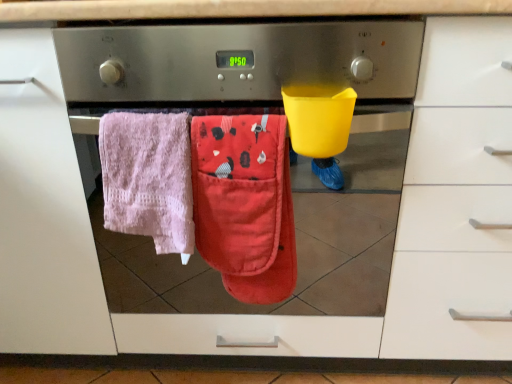
Question: Can you confirm if pink terry cloth towel at left, arranged as the second beach towel when viewed from the right, is positioned to the left of red cotton oven mitt at center, arranged as the first beach towel when viewed from the right?

Choices:
 (A) no
 (B) yes

Answer: (B)

Question: From the image's perspective, does pink terry cloth towel at left, marked as the 1th beach towel in a left-to-right arrangement, appear lower than red cotton oven mitt at center, placed as the 2th beach towel when sorted from left to right?

Choices:
 (A) yes
 (B) no

Answer: (B)

Question: Is pink terry cloth towel at left, marked as the 1th beach towel in a left-to-right arrangement, smaller than red cotton oven mitt at center, arranged as the first beach towel when viewed from the right?

Choices:
 (A) no
 (B) yes

Answer: (A)

Question: Does pink terry cloth towel at left, arranged as the second beach towel when viewed from the right, touch red cotton oven mitt at center, arranged as the first beach towel when viewed from the right?

Choices:
 (A) yes
 (B) no

Answer: (A)

Question: From the image's perspective, does pink terry cloth towel at left, marked as the 1th beach towel in a left-to-right arrangement, appear higher than red cotton oven mitt at center, arranged as the first beach towel when viewed from the right?

Choices:
 (A) yes
 (B) no

Answer: (A)

Question: Does pink terry cloth towel at left, arranged as the second beach towel when viewed from the right, have a lesser height compared to red cotton oven mitt at center, placed as the 2th beach towel when sorted from left to right?

Choices:
 (A) no
 (B) yes

Answer: (B)

Question: Does red cotton oven mitt at center, arranged as the first beach towel when viewed from the right, lie in front of pink terry cloth towel at left, marked as the 1th beach towel in a left-to-right arrangement?

Choices:
 (A) yes
 (B) no

Answer: (B)

Question: Is red cotton oven mitt at center, arranged as the first beach towel when viewed from the right, outside of pink terry cloth towel at left, marked as the 1th beach towel in a left-to-right arrangement?

Choices:
 (A) no
 (B) yes

Answer: (B)

Question: Considering the relative sizes of red cotton oven mitt at center, placed as the 2th beach towel when sorted from left to right, and pink terry cloth towel at left, arranged as the second beach towel when viewed from the right, in the image provided, is red cotton oven mitt at center, placed as the 2th beach towel when sorted from left to right, thinner than pink terry cloth towel at left, arranged as the second beach towel when viewed from the right,?

Choices:
 (A) yes
 (B) no

Answer: (A)

Question: Considering the relative positions of red cotton oven mitt at center, arranged as the first beach towel when viewed from the right, and pink terry cloth towel at left, arranged as the second beach towel when viewed from the right, in the image provided, is red cotton oven mitt at center, arranged as the first beach towel when viewed from the right, to the left of pink terry cloth towel at left, arranged as the second beach towel when viewed from the right, from the viewer's perspective?

Choices:
 (A) yes
 (B) no

Answer: (B)

Question: Does red cotton oven mitt at center, arranged as the first beach towel when viewed from the right, have a smaller size compared to pink terry cloth towel at left, arranged as the second beach towel when viewed from the right?

Choices:
 (A) no
 (B) yes

Answer: (B)

Question: Considering the relative positions of red cotton oven mitt at center, arranged as the first beach towel when viewed from the right, and pink terry cloth towel at left, arranged as the second beach towel when viewed from the right, in the image provided, is red cotton oven mitt at center, arranged as the first beach towel when viewed from the right, to the right of pink terry cloth towel at left, arranged as the second beach towel when viewed from the right, from the viewer's perspective?

Choices:
 (A) no
 (B) yes

Answer: (B)

Question: Considering the positions of red cotton oven mitt at center, placed as the 2th beach towel when sorted from left to right, and pink terry cloth towel at left, marked as the 1th beach towel in a left-to-right arrangement, in the image, is red cotton oven mitt at center, placed as the 2th beach towel when sorted from left to right, bigger or smaller than pink terry cloth towel at left, marked as the 1th beach towel in a left-to-right arrangement,?

Choices:
 (A) small
 (B) big

Answer: (A)